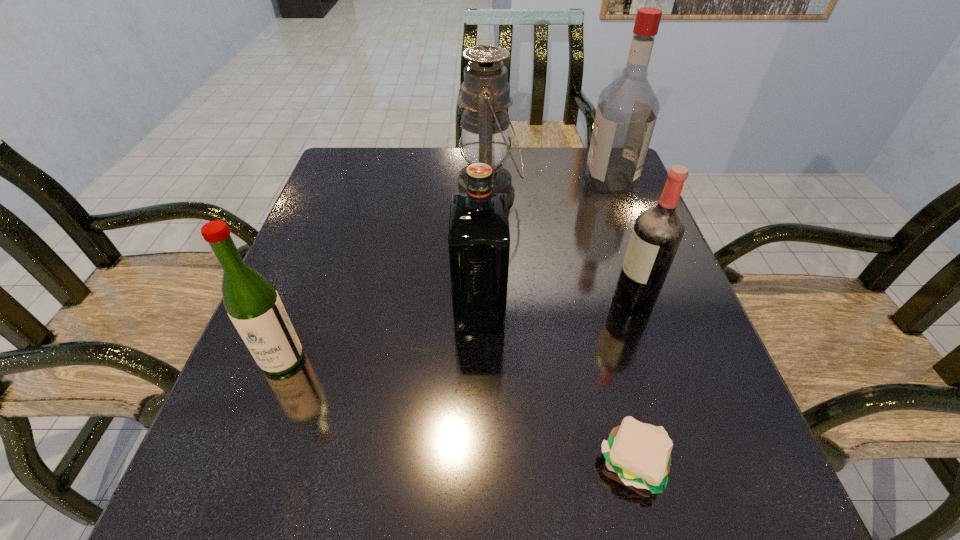
I want to click on vacant area that lies between the nearest liquor and the second liquor from left to right, so click(x=381, y=333).

This screenshot has width=960, height=540. I want to click on free space between the farthest liquor and the third liquor from right to left, so click(544, 245).

You are a GUI agent. You are given a task and a screenshot of the screen. Output one action in this format:
    pyautogui.click(x=<x>, y=<y>)
    Task: Click on the free spot between the oil lamp and the nearest object
    This screenshot has height=540, width=960.
    Given the screenshot: What is the action you would take?
    pyautogui.click(x=562, y=329)

At what (x,y) coordinates should I click in order to perform the action: click on vacant area between the second liquor from left to right and the farthest liquor. Please return your answer as a coordinate pair (x, y). Image resolution: width=960 pixels, height=540 pixels. Looking at the image, I should click on (544, 245).

This screenshot has height=540, width=960. I want to click on empty space that is in between the fifth farthest object and the oil lamp, so (385, 277).

In order to click on vacant space that's between the oil lamp and the tallest liquor in this screenshot , I will do `click(549, 188)`.

What are the coordinates of `the closest object relative to the third liquor from right to left` in the screenshot? It's located at (485, 93).

Identify the location of object that is the fifth closest one to the second liquor from left to right. The height and width of the screenshot is (540, 960). (627, 109).

Select which liquor is the closest to the oil lamp. Please provide its 2D coordinates. Your answer should be formatted as a tuple, i.e. [(x, y)], where the tuple contains the x and y coordinates of a point satisfying the conditions above.

[(627, 109)]

Image resolution: width=960 pixels, height=540 pixels. In order to click on liquor that stands as the fourth closest to the nearest object in this screenshot , I will do click(627, 109).